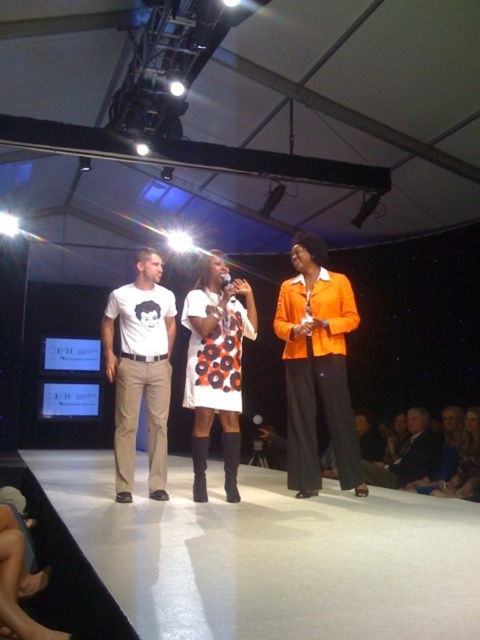
You are a photographer positioned at the back of the runway. You want to take a photo of the orange matte blazer at center and the dark gray suit at lower right without any obstruction. Based on their positions, which one should you focus on first to ensure both are visible?

The orange matte blazer at center is in front of the dark gray suit at lower right. To ensure both are visible without obstruction, focus on the dark gray suit at lower right first, then adjust to include the orange matte blazer at center in the foreground.

You are a photographer positioned at the camera. You want to capture a closeup shot of the orange matte blazer at center. Given that your camera can focus on objects within 10 feet, will you need to adjust your position to get a clear shot?

The orange matte blazer at center is 12.37 feet away from the camera, which is beyond the camera focus range of 10 feet. Therefore, you need to move closer to the orange matte blazer at center to capture a clear closeup shot.